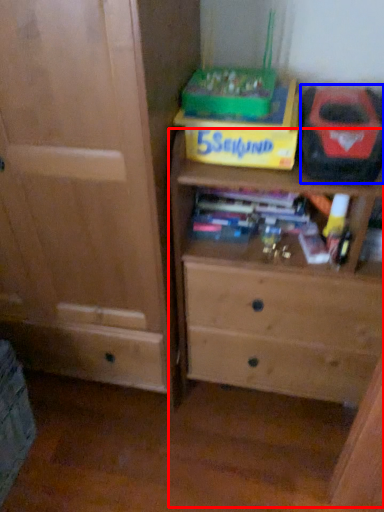
Question: Among these objects, which one is nearest to the camera, chest of drawers (highlighted by a red box) or kit (highlighted by a blue box)?

Choices:
 (A) chest of drawers
 (B) kit

Answer: (A)